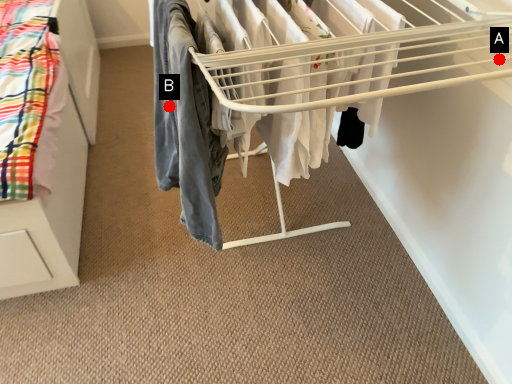
Question: Two points are circled on the image, labeled by A and B beside each circle. Which point is closer to the camera?

Choices:
 (A) A is closer
 (B) B is closer

Answer: (A)